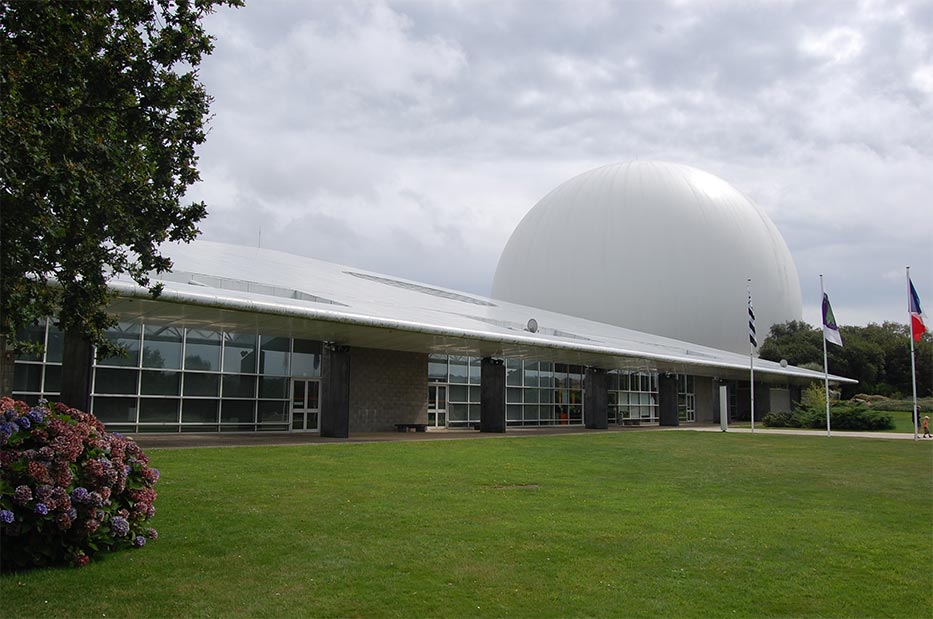
Locate an element on the screen. windows is located at coordinates (191, 379).